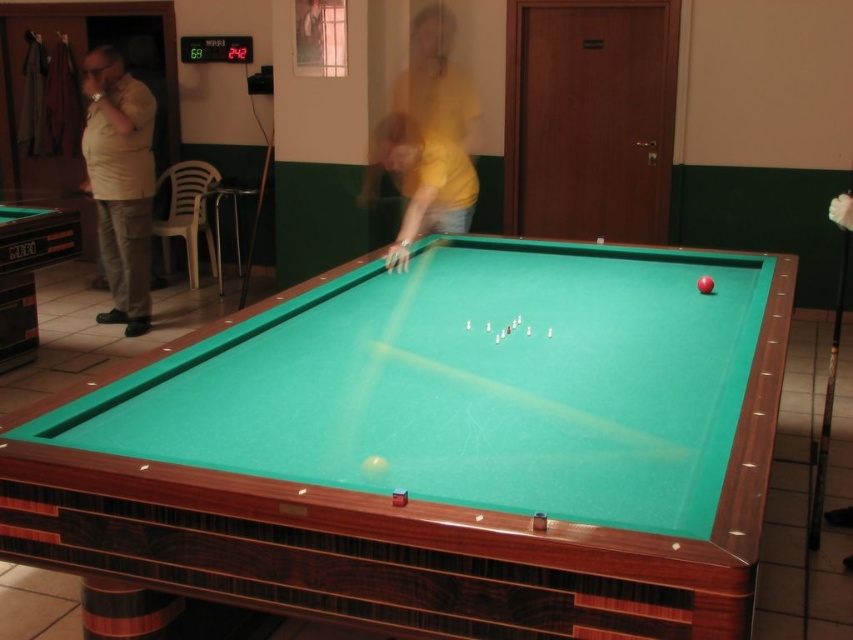
You are a photographer setting up a shoot in the pool hall. You need to place a 1.2 meter tall tripod between the beige fabric shirt at left and the wooden cue at center. Based on their heights, will the tripod fit vertically between them without touching either?

The beige fabric shirt at left is much taller than the wooden cue at center. Since the tripod is 1.2 meters tall, it may not fit vertically between them if the distance between their heights is less than 1.2 meters. However, the exact vertical clearance isn

You are a pool player who wants to place your wooden cue at center on the green felt billiard table at center. Is the table large enough to accommodate the cue?

The green felt billiard table at center is bigger than wooden cue at center, so yes, the table is large enough to accommodate the cue.

You are standing in the pool hall and want to place a small decorative item on the pool table. You have two options for placement locations corresponding to the coordinates point (404,333) and point (381,128). Which coordinate should you choose if you want the item to appear closer to you when viewed from your current position?

Point (404,333) should be chosen because it is closer to the camera than point (381,128), making it appear nearer when viewed from your current position.